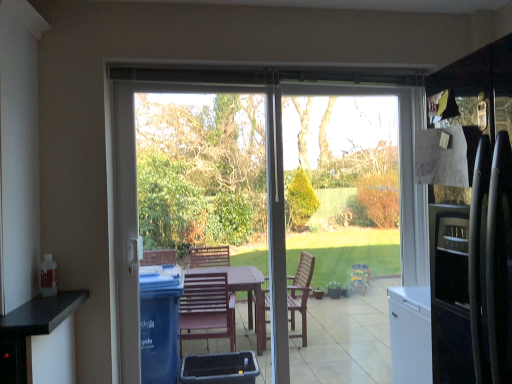
This screenshot has height=384, width=512. I want to click on empty space that is ontop of transparent plastic screen door at center, so click(197, 89).